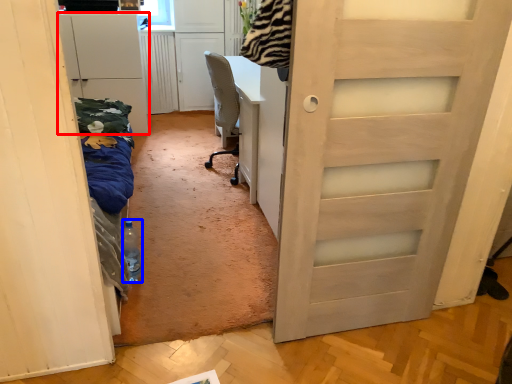
Question: Which object is further to the camera taking this photo, cabinetry (highlighted by a red box) or bottle (highlighted by a blue box)?

Choices:
 (A) cabinetry
 (B) bottle

Answer: (A)